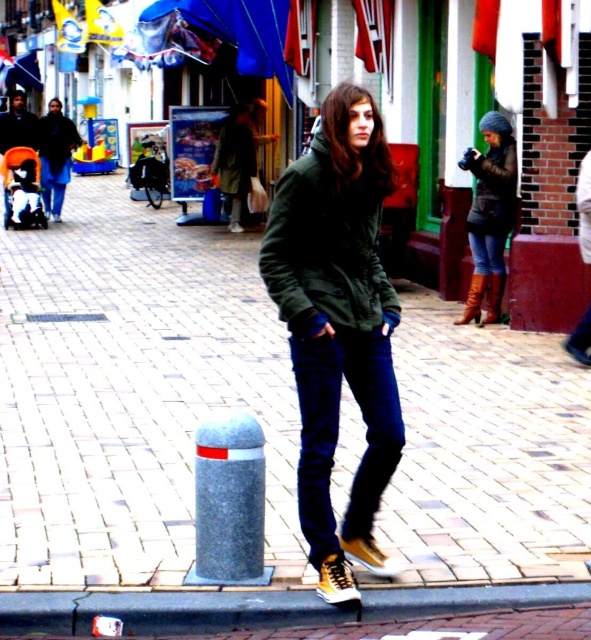
Question: Which object appears closest to the camera in this image?

Choices:
 (A) dark green fabric jacket at center
 (B) jeans at center

Answer: (B)

Question: Based on their relative distances, which object is nearer to the jeans at center?

Choices:
 (A) green fuzzy jacket at center
 (B) dark green hoodie at center
 (C) dark green fabric jacket at center
 (D) dark blue denim jeans at left

Answer: (A)

Question: From the image, what is the correct spatial relationship of green fuzzy jacket at center in relation to dark green matte jacket at center?

Choices:
 (A) below
 (B) above

Answer: (A)

Question: Can you confirm if gray concrete curb at lower center is positioned below dark green matte jacket at center?

Choices:
 (A) yes
 (B) no

Answer: (A)

Question: Which point is farther to the camera?

Choices:
 (A) dark green fabric jacket at center
 (B) brown leather boots at center
 (C) jeans at center

Answer: (A)

Question: Is dark green matte jacket at center to the left of jeans at center from the viewer's perspective?

Choices:
 (A) yes
 (B) no

Answer: (A)